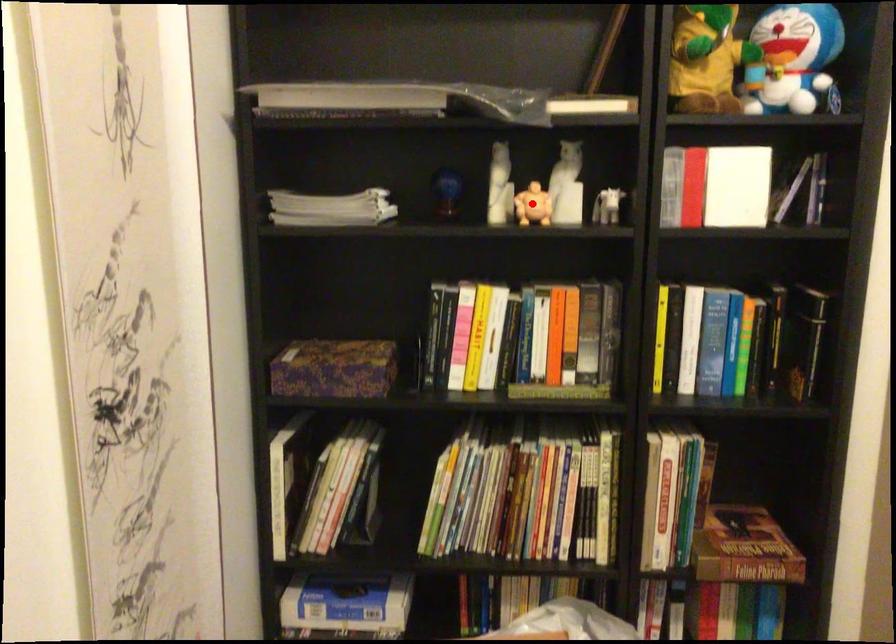
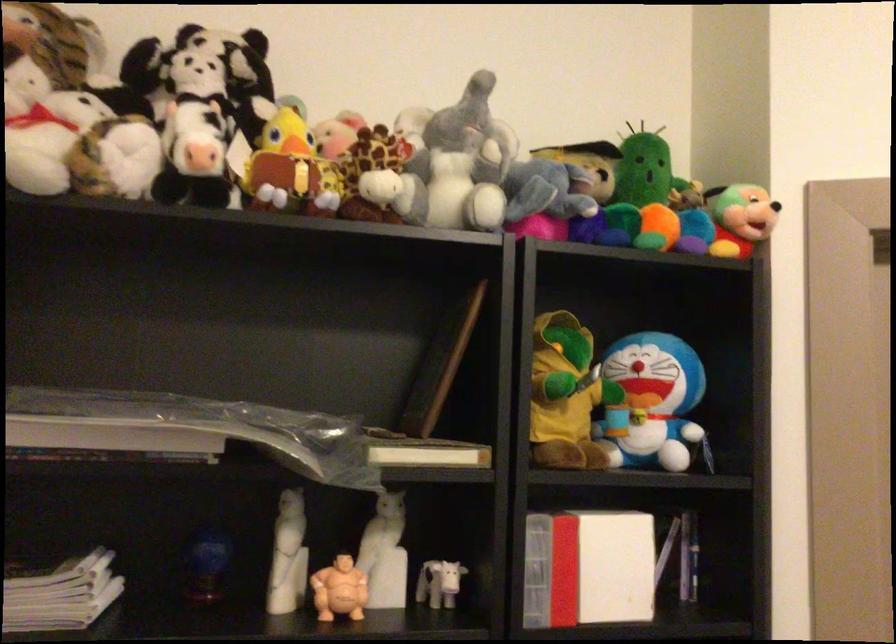
Where in the second image is the point corresponding to the highlighted location from the first image?

(339, 589)